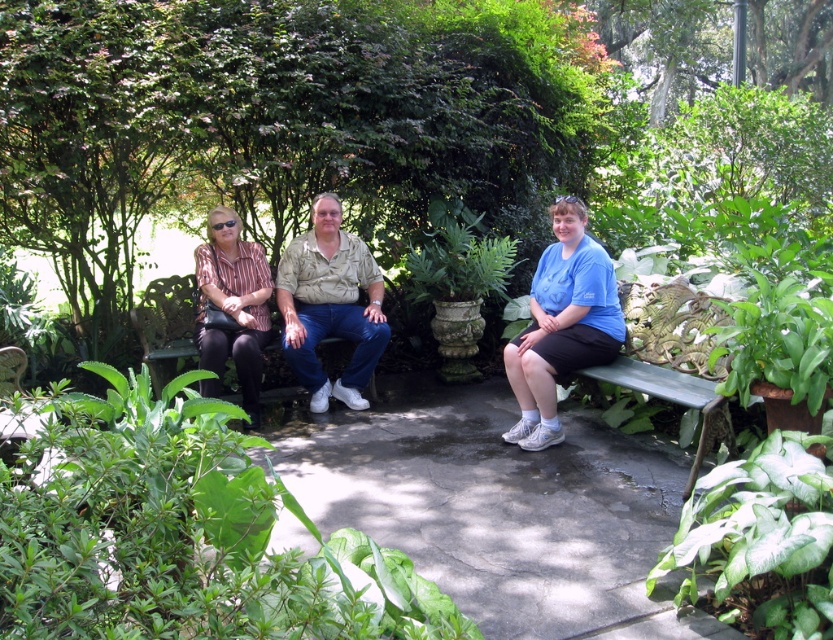
Is green leafy plant at center taller than blue cotton shirt at center?

Incorrect, green leafy plant at center's height is not larger of blue cotton shirt at center's.

Is green leafy plant at center to the left of blue cotton shirt at center from the viewer's perspective?

Correct, you'll find green leafy plant at center to the left of blue cotton shirt at center.

Image resolution: width=833 pixels, height=640 pixels. What do you see at coordinates (180, 532) in the screenshot? I see `green leafy plant at center` at bounding box center [180, 532].

Where is `green leafy plant at center`? green leafy plant at center is located at coordinates (180, 532).

How far apart are green leafy plant at center and matte khaki shirt at center?

The distance of green leafy plant at center from matte khaki shirt at center is 3.33 meters.

Can you confirm if green leafy plant at center is positioned to the right of matte khaki shirt at center?

Indeed, green leafy plant at center is positioned on the right side of matte khaki shirt at center.

Who is more forward, (x=100, y=372) or (x=362, y=285)?

Point (x=100, y=372)

This screenshot has height=640, width=833. Find the location of `green leafy plant at center`. green leafy plant at center is located at coordinates (180, 532).

Is striped fabric shirt at left smaller than green metallic bench at lower right?

Incorrect, striped fabric shirt at left is not smaller in size than green metallic bench at lower right.

Between striped fabric shirt at left and green metallic bench at lower right, which one has more height?

striped fabric shirt at left

Who is more forward, [235,364] or [674,387]?

Point [674,387] is in front.

Image resolution: width=833 pixels, height=640 pixels. Identify the location of striped fabric shirt at left. (233, 305).